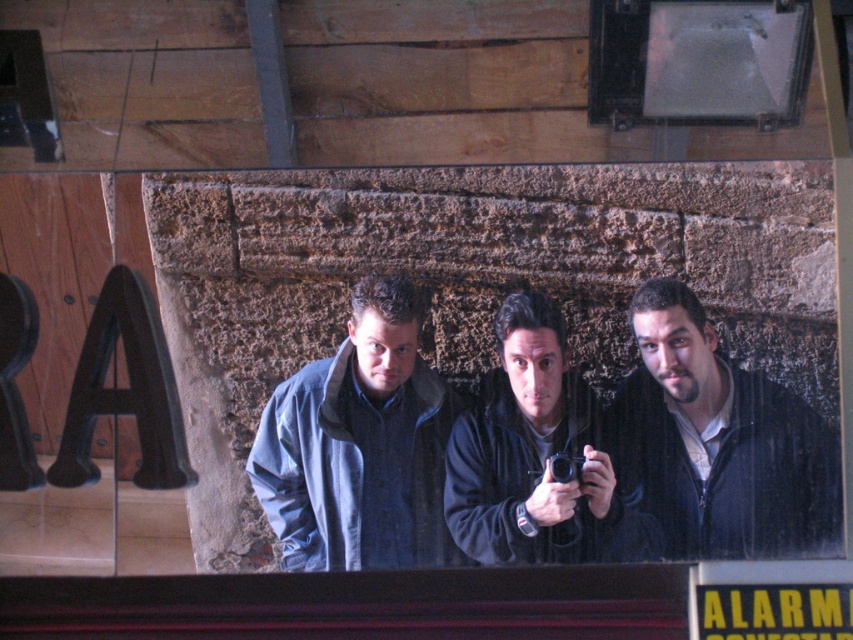
Between dark blue jacket at center and denim jacket at center, which one is positioned lower?

Positioned lower is denim jacket at center.

Who is more distant from viewer, (x=682, y=384) or (x=270, y=508)?

Point (x=270, y=508)

The height and width of the screenshot is (640, 853). In order to click on dark blue jacket at center in this screenshot , I will do `click(717, 445)`.

Is point (668, 513) positioned in front of point (813, 618)?

No.

Find the location of `dark blue jacket at center`. dark blue jacket at center is located at coordinates (717, 445).

Who is more forward, [779,474] or [698,602]?

Point [698,602]

Find the location of a particular element. dark blue jacket at center is located at coordinates (717, 445).

From the picture: Which is more to the left, dark blue fleece jacket at center or yellow paper at upper center?

From the viewer's perspective, dark blue fleece jacket at center appears more on the left side.

Which is in front, point (483, 422) or point (761, 609)?

Positioned in front is point (761, 609).

At what (x,y) coordinates should I click in order to perform the action: click on dark blue fleece jacket at center. Please return your answer as a coordinate pair (x, y). Looking at the image, I should click on (527, 451).